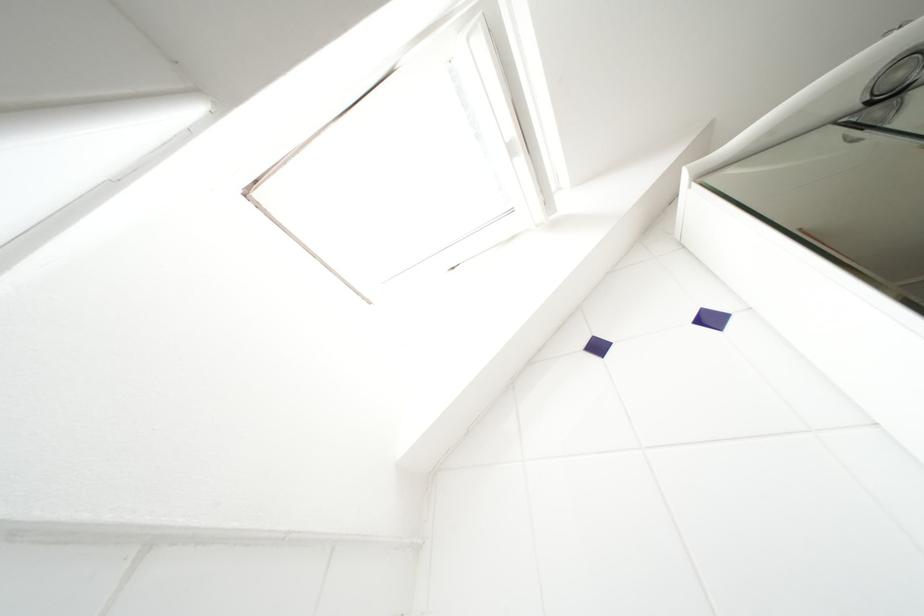
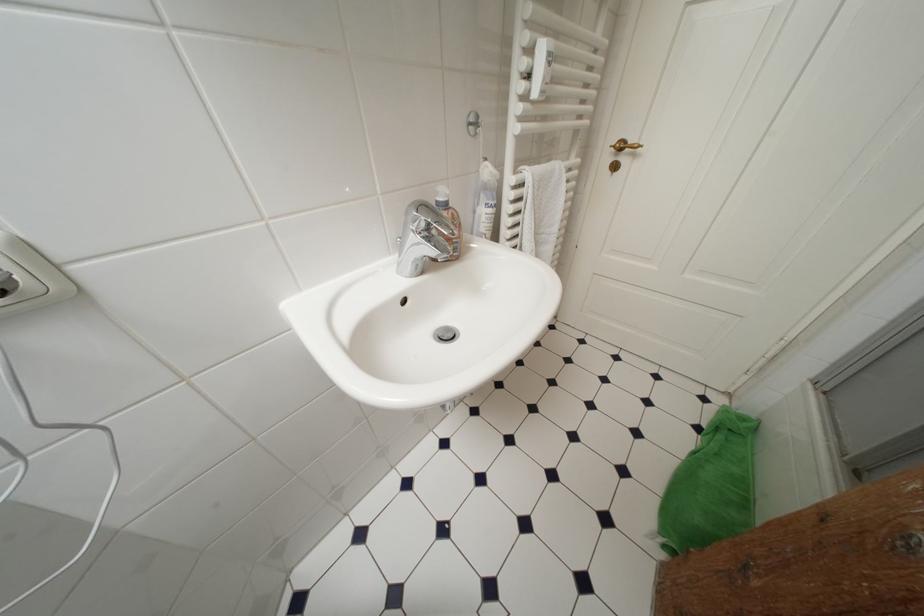
The first image is from the beginning of the video and the second image is from the end. How did the camera likely rotate when shooting the video?

The rotation direction of the camera is right-down.